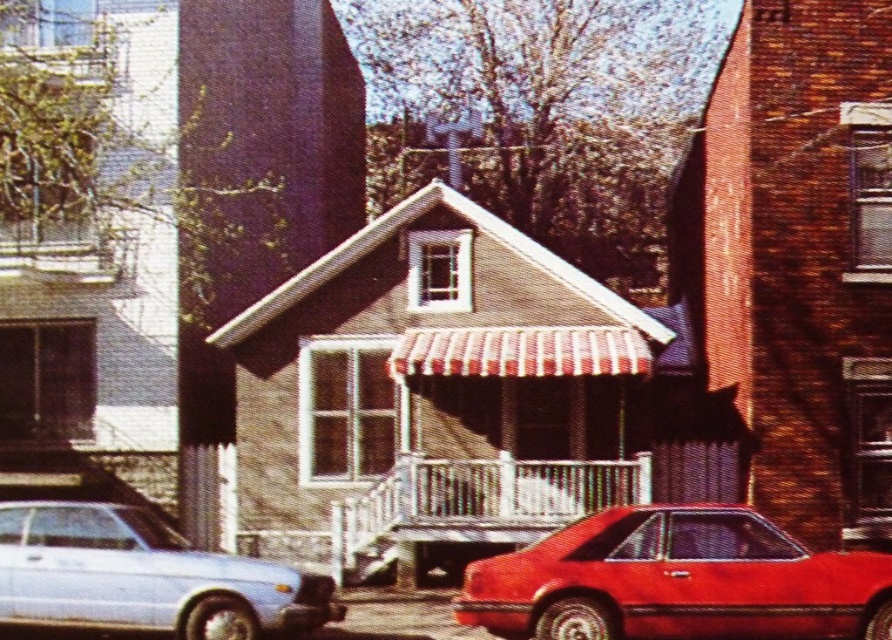
You are a delivery driver who needs to park your van between the shiny red car at lower right and the matte silver sedan at lower left. Your van is 2 meters tall. Can you park there without hitting the roof?

The shiny red car at lower right is much taller than the matte silver sedan at lower left. Since the van is 2 meters tall, but the description only compares their heights without specifying exact measurements, it is uncertain if there is enough vertical clearance. You should check the actual height of the taller vehicle before deciding to park.

You are driving a delivery van and need to park between the shiny red car at lower right and the matte silver sedan at lower left. Is there enough space for your van, which is 6 meters long?

The shiny red car at lower right is in front of the matte silver sedan at lower left, but the distance between them isn not specified. Without knowing the exact space between the two cars, it is impossible to determine if the van will fit.